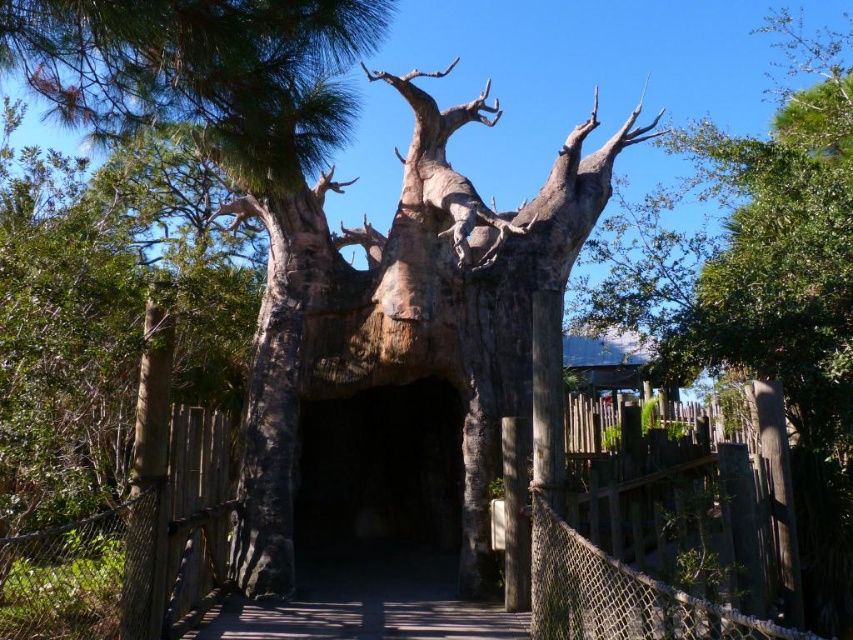
You are standing at the entrance of the structure and want to cross to the other side. Where exactly is the rope bridge at center located in the image?

The rope bridge at center is located at point 0.867 on the x axis and 0.767 on the y axis.

In the scene shown: You are standing in front of the artistic tree structure and want to determine the relative positions of two points marked on the structure. Which point, point (329, 484) or point (309, 608), is closer to you?

Point (329, 484) is closer to you because it is further to the viewer than point (309, 608).